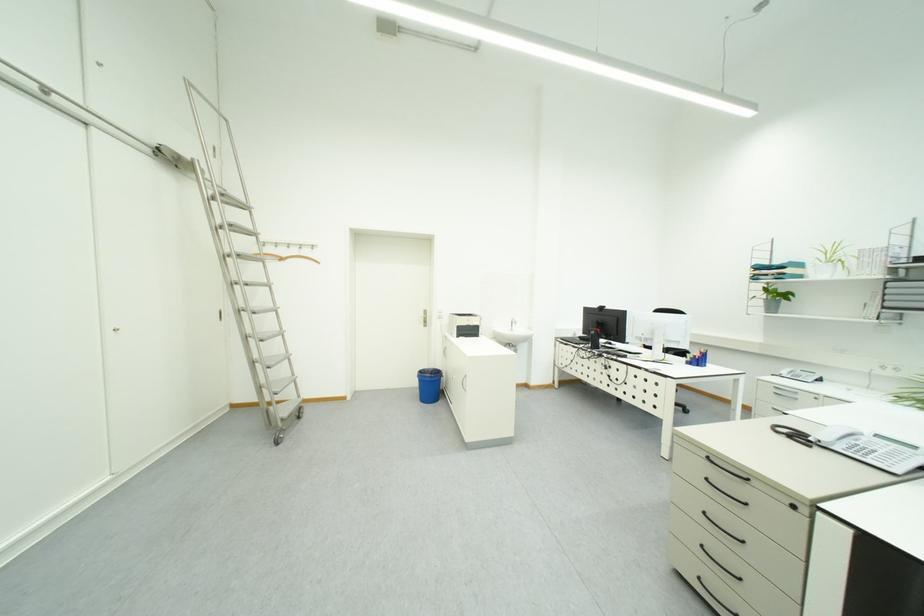
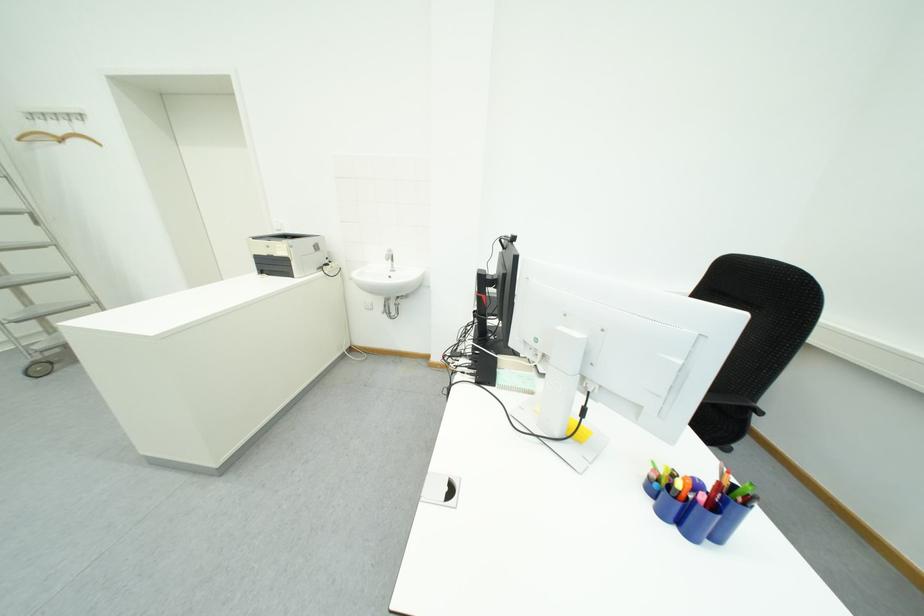
In the second image, find the point that corresponds to (x=295, y=257) in the first image.

(69, 136)